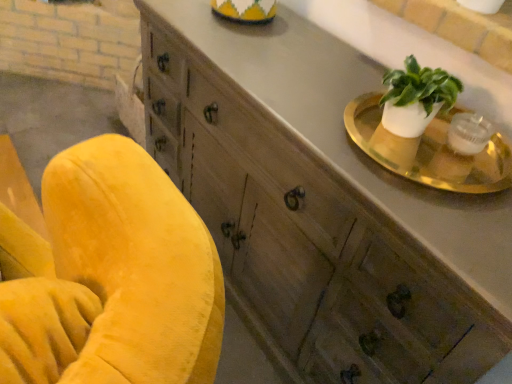
Where is `free space in front of gold metallic tray at upper right`? The height and width of the screenshot is (384, 512). free space in front of gold metallic tray at upper right is located at coordinates (446, 220).